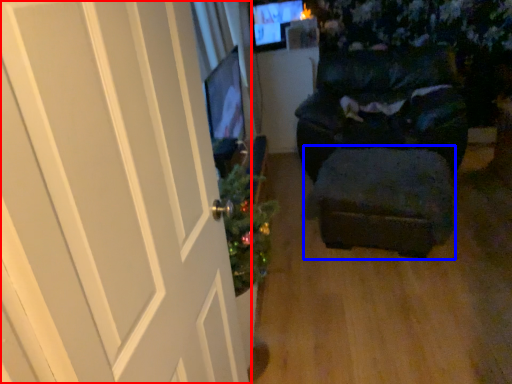
Question: Among these objects, which one is farthest to the camera, door (highlighted by a red box) or stool (highlighted by a blue box)?

Choices:
 (A) door
 (B) stool

Answer: (B)